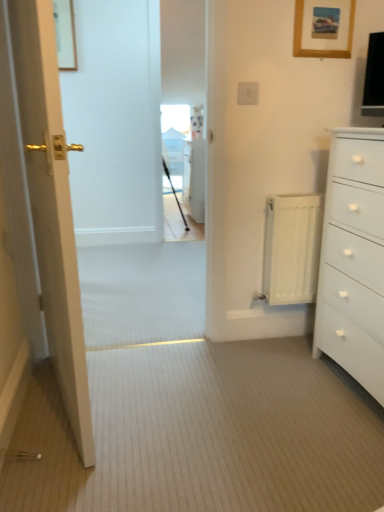
What do you see at coordinates (65, 35) in the screenshot?
I see `wooden picture frame at upper left, positioned as the 2th picture frame in front-to-back order` at bounding box center [65, 35].

This screenshot has height=512, width=384. Find the location of `white matte chest of drawers at right`. white matte chest of drawers at right is located at coordinates (353, 259).

Describe the element at coordinates (324, 30) in the screenshot. I see `wooden picture frame at upper right, the 1th picture frame positioned from the right` at that location.

What do you see at coordinates (248, 93) in the screenshot? The image size is (384, 512). I see `white plastic electric outlet at upper center` at bounding box center [248, 93].

This screenshot has height=512, width=384. I want to click on wooden picture frame at upper left, arranged as the 2th picture frame when viewed from the right, so click(x=65, y=35).

Consider the image. Does white metallic radiator at right have a greater height compared to matte gold door at left?

Incorrect, the height of white metallic radiator at right is not larger of that of matte gold door at left.

Does white metallic radiator at right have a smaller size compared to matte gold door at left?

Indeed, white metallic radiator at right has a smaller size compared to matte gold door at left.

Would you consider white metallic radiator at right to be distant from matte gold door at left?

Indeed, white metallic radiator at right is not near matte gold door at left.

Considering the sizes of objects white metallic radiator at right and matte gold door at left in the image provided, who is wider, white metallic radiator at right or matte gold door at left?

With larger width is matte gold door at left.

Is white plastic electric outlet at upper center wider than matte gold door at left?

No, white plastic electric outlet at upper center is not wider than matte gold door at left.

Where is `door below the white plastic electric outlet at upper center (from the image's perspective)`? door below the white plastic electric outlet at upper center (from the image's perspective) is located at coordinates (52, 206).

How distant is white plastic electric outlet at upper center from matte gold door at left?

1.01 meters.

Is white plastic electric outlet at upper center far away from matte gold door at left?

white plastic electric outlet at upper center is far away from matte gold door at left.

What are the coordinates of `door lying in front of the wooden picture frame at upper right, the second picture frame in the back-to-front sequence` in the screenshot? It's located at [52, 206].

Which object is positioned more to the right, wooden picture frame at upper right, the second picture frame in the back-to-front sequence, or matte gold door at left?

From the viewer's perspective, wooden picture frame at upper right, the second picture frame in the back-to-front sequence, appears more on the right side.

Considering the sizes of wooden picture frame at upper right, positioned as the 2th picture frame in left-to-right order, and matte gold door at left in the image, is wooden picture frame at upper right, positioned as the 2th picture frame in left-to-right order, taller or shorter than matte gold door at left?

wooden picture frame at upper right, positioned as the 2th picture frame in left-to-right order, is shorter than matte gold door at left.

From a real-world perspective, is wooden picture frame at upper right, the 1th picture frame positioned from the right, positioned above or below matte gold door at left?

Clearly, from a real-world perspective, wooden picture frame at upper right, the 1th picture frame positioned from the right, is above matte gold door at left.

Would you consider white matte chest of drawers at right to be distant from wooden picture frame at upper right, positioned as the 2th picture frame in left-to-right order?

Actually, white matte chest of drawers at right and wooden picture frame at upper right, positioned as the 2th picture frame in left-to-right order, are a little close together.

Between white matte chest of drawers at right and wooden picture frame at upper right, positioned as the 2th picture frame in left-to-right order, which one has larger size?

white matte chest of drawers at right.

Does white matte chest of drawers at right have a lesser height compared to wooden picture frame at upper right, the 1th picture frame positioned from the right?

No.

From the image's perspective, is white matte chest of drawers at right above wooden picture frame at upper right, the first picture frame in the bottom-to-top sequence?

No.

Locate an element on the screen. Image resolution: width=384 pixels, height=512 pixels. radiator below the white plastic electric outlet at upper center (from a real-world perspective) is located at coordinates (292, 248).

Does white metallic radiator at right have a larger size compared to white plastic electric outlet at upper center?

Indeed, white metallic radiator at right has a larger size compared to white plastic electric outlet at upper center.

Which object is closer to the camera taking this photo, white metallic radiator at right or white plastic electric outlet at upper center?

white plastic electric outlet at upper center is in front.

From a real-world perspective, which object stands above the other?

In real-world perspective, wooden picture frame at upper left, which is counted as the first picture frame, starting from the left, is above.

Is wooden picture frame at upper right, the 1th picture frame positioned from the right, positioned before wooden picture frame at upper left, the second picture frame in the bottom-to-top sequence?

Yes, it is in front of wooden picture frame at upper left, the second picture frame in the bottom-to-top sequence.

How distant is wooden picture frame at upper right, the 1th picture frame positioned from the right, from wooden picture frame at upper left, acting as the first picture frame starting from the back?

wooden picture frame at upper right, the 1th picture frame positioned from the right, and wooden picture frame at upper left, acting as the first picture frame starting from the back, are 2.13 meters apart from each other.

Considering the relative positions of wooden picture frame at upper right, the second picture frame in the back-to-front sequence, and wooden picture frame at upper left, which is counted as the first picture frame, starting from the left, in the image provided, is wooden picture frame at upper right, the second picture frame in the back-to-front sequence, to the left or to the right of wooden picture frame at upper left, which is counted as the first picture frame, starting from the left,?

Based on their positions, wooden picture frame at upper right, the second picture frame in the back-to-front sequence, is located to the right of wooden picture frame at upper left, which is counted as the first picture frame, starting from the left.

Is matte gold door at left not near wooden picture frame at upper left, which is counted as the first picture frame, starting from the left?

Yes, matte gold door at left and wooden picture frame at upper left, which is counted as the first picture frame, starting from the left, are quite far apart.

In the image, there is a wooden picture frame at upper left, which is counted as the first picture frame, starting from the left. Where is `door below it (from a real-world perspective)`? Image resolution: width=384 pixels, height=512 pixels. door below it (from a real-world perspective) is located at coordinates (52, 206).

Considering the positions of point (24, 109) and point (67, 70), is point (24, 109) closer or farther from the camera than point (67, 70)?

Point (24, 109) is closer to the camera than point (67, 70).

How different are the orientations of matte gold door at left and wooden picture frame at upper left, acting as the first picture frame starting from the back, in degrees?

matte gold door at left and wooden picture frame at upper left, acting as the first picture frame starting from the back, are facing 106 degrees away from each other.

The image size is (384, 512). What are the coordinates of `door to the left of white metallic radiator at right` in the screenshot? It's located at (52, 206).

Where is `door below the white plastic electric outlet at upper center (from the image's perspective)`? Image resolution: width=384 pixels, height=512 pixels. door below the white plastic electric outlet at upper center (from the image's perspective) is located at coordinates (52, 206).

When comparing their distances from matte gold door at left, does wooden picture frame at upper right, the 1th picture frame positioned from the right, or white metallic radiator at right seem closer?

Based on the image, white metallic radiator at right appears to be nearer to matte gold door at left.

Looking at the image, which one is located further to white metallic radiator at right, wooden picture frame at upper left, positioned as the 2th picture frame in front-to-back order, or matte gold door at left?

Among the two, wooden picture frame at upper left, positioned as the 2th picture frame in front-to-back order, is located further to white metallic radiator at right.

Consider the image. Estimate the real-world distances between objects in this image. Which object is further from wooden picture frame at upper left, arranged as the 1th picture frame when viewed from the top, white metallic radiator at right or white plastic electric outlet at upper center?

white metallic radiator at right lies further to wooden picture frame at upper left, arranged as the 1th picture frame when viewed from the top, than the other object.

Consider the image. Which object lies nearer to the anchor point white plastic electric outlet at upper center, white metallic radiator at right or matte gold door at left?

white metallic radiator at right is positioned closer to the anchor white plastic electric outlet at upper center.

Considering their positions, is wooden picture frame at upper right, the 1th picture frame positioned from the right, positioned further to white matte chest of drawers at right than white plastic electric outlet at upper center?

white plastic electric outlet at upper center is positioned further to the anchor white matte chest of drawers at right.

Which object lies nearer to the anchor point white matte chest of drawers at right, white metallic radiator at right or matte gold door at left?

white metallic radiator at right.

From the image, which object appears to be farther from matte gold door at left, wooden picture frame at upper left, arranged as the 1th picture frame when viewed from the top, or white metallic radiator at right?

wooden picture frame at upper left, arranged as the 1th picture frame when viewed from the top.

When comparing their distances from matte gold door at left, does white metallic radiator at right or white matte chest of drawers at right seem closer?

white metallic radiator at right is closer to matte gold door at left.

Find the location of a particular element. The height and width of the screenshot is (512, 384). electric outlet between wooden picture frame at upper right, the second picture frame in the back-to-front sequence, and white metallic radiator at right vertically is located at coordinates (248, 93).

Find the location of a particular element. electric outlet between matte gold door at left and white metallic radiator at right from front to back is located at coordinates (248, 93).

I want to click on radiator situated between matte gold door at left and wooden picture frame at upper right, the 1th picture frame positioned from the right, from left to right, so click(x=292, y=248).

The width and height of the screenshot is (384, 512). Find the location of `electric outlet between matte gold door at left and wooden picture frame at upper left, the second picture frame in the bottom-to-top sequence, in the front-back direction`. electric outlet between matte gold door at left and wooden picture frame at upper left, the second picture frame in the bottom-to-top sequence, in the front-back direction is located at coordinates (248, 93).